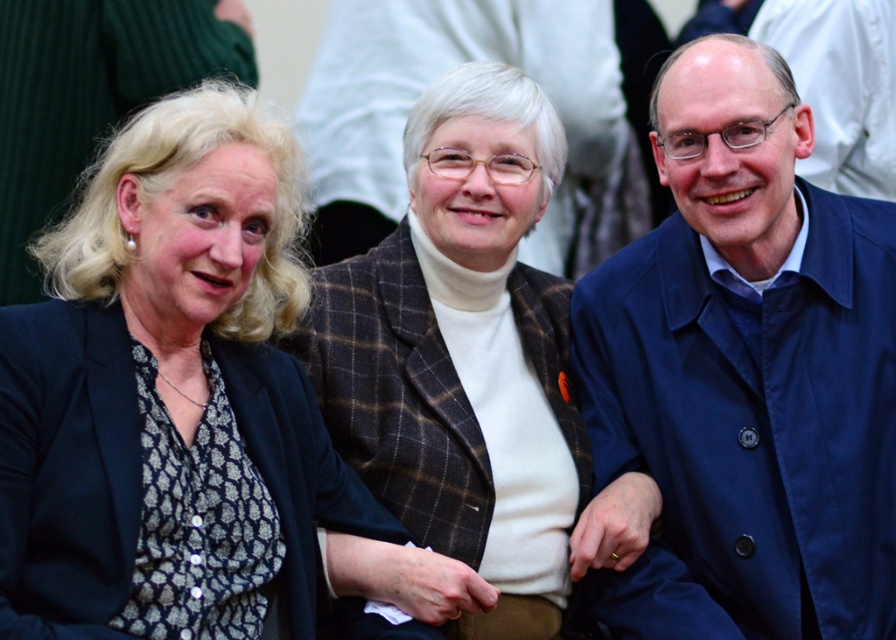
You are a photographer taking a group photo of the three people. You need to ensure that the blue fabric coat at right and the brown plaid blazer at center are both clearly visible in the frame. Given their height difference, which item might require you to adjust the camera angle to avoid being obscured?

The blue fabric coat at right is much taller than the brown plaid blazer at center, so you may need to lower the camera angle to ensure the blue fabric coat at right is fully visible without blocking the brown plaid blazer at center.